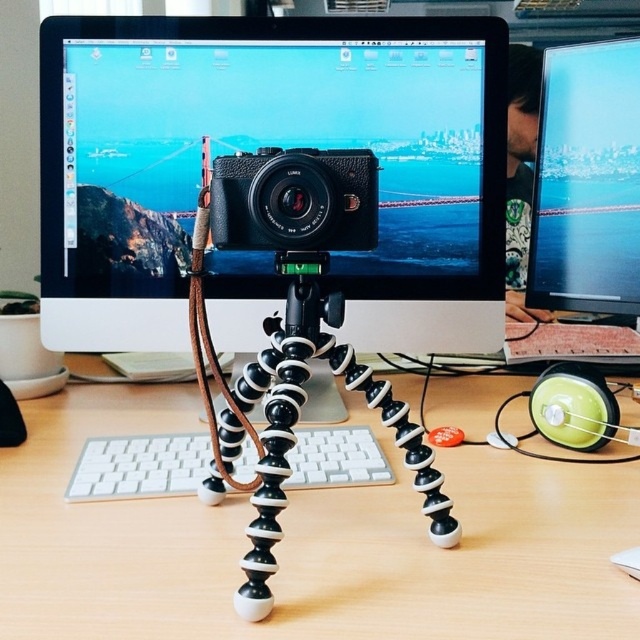
Question: Which object is the farthest from the leather textured camera at center?

Choices:
 (A) matte black monitor at upper right
 (B) white plastic keyboard at center
 (C) white matte mouse at center

Answer: (A)

Question: Which of the following is the closest to the observer?

Choices:
 (A) (316, 436)
 (B) (636, 554)
 (C) (35, 556)

Answer: (B)

Question: Does wooden at center lie in front of matte black monitor at upper right?

Choices:
 (A) no
 (B) yes

Answer: (B)

Question: Does wooden at center have a smaller size compared to leather textured camera at center?

Choices:
 (A) no
 (B) yes

Answer: (A)

Question: Estimate the real-world distances between objects in this image. Which object is farther from the satin black monitor at center?

Choices:
 (A) wooden at center
 (B) matte black monitor at upper right

Answer: (B)

Question: Does wooden at center have a greater width compared to matte black monitor at upper right?

Choices:
 (A) yes
 (B) no

Answer: (A)